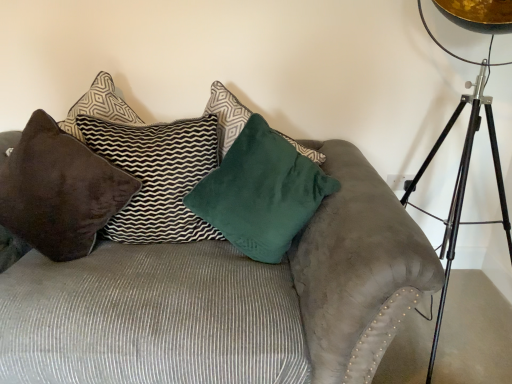
Question: Is velvet brown pillow at upper left, the second pillow when ordered from right to left, further to the viewer compared to suede couch at center?

Choices:
 (A) yes
 (B) no

Answer: (A)

Question: Is velvet brown pillow at upper left, which ranks as the 2th pillow in left-to-right order, taller than suede couch at center?

Choices:
 (A) yes
 (B) no

Answer: (B)

Question: Is suede couch at center inside velvet brown pillow at upper left, the second pillow when ordered from right to left?

Choices:
 (A) yes
 (B) no

Answer: (B)

Question: Could you tell me if velvet brown pillow at upper left, which ranks as the 2th pillow in left-to-right order, is turned towards suede couch at center?

Choices:
 (A) yes
 (B) no

Answer: (A)

Question: From a real-world perspective, is suede couch at center physically located above or below velvet brown pillow at upper left, which ranks as the 2th pillow in left-to-right order?

Choices:
 (A) below
 (B) above

Answer: (A)

Question: Is suede couch at center situated inside velvet brown pillow at upper left, the second pillow when ordered from right to left, or outside?

Choices:
 (A) outside
 (B) inside

Answer: (A)

Question: In the image, is suede couch at center positioned in front of or behind velvet brown pillow at upper left, which ranks as the 2th pillow in left-to-right order?

Choices:
 (A) front
 (B) behind

Answer: (A)

Question: Visually, is suede couch at center positioned to the left or to the right of velvet brown pillow at upper left, the second pillow when ordered from right to left?

Choices:
 (A) right
 (B) left

Answer: (A)

Question: Is suede couch at center wider or thinner than velvet green pillow at center, the 3th pillow positioned from the left?

Choices:
 (A) wide
 (B) thin

Answer: (A)

Question: From the image's perspective, is suede couch at center positioned above or below velvet green pillow at center, the 3th pillow positioned from the left?

Choices:
 (A) below
 (B) above

Answer: (A)

Question: Based on their sizes in the image, would you say suede couch at center is bigger or smaller than velvet green pillow at center, the 3th pillow positioned from the left?

Choices:
 (A) big
 (B) small

Answer: (A)

Question: Considering their positions, is suede couch at center located in front of or behind velvet green pillow at center, the 3th pillow positioned from the left?

Choices:
 (A) behind
 (B) front

Answer: (B)

Question: Considering the positions of velvet green pillow at center, which is counted as the 1th pillow, starting from the right, and velvet brown pillow at upper left, the second pillow when ordered from right to left, in the image, is velvet green pillow at center, which is counted as the 1th pillow, starting from the right, taller or shorter than velvet brown pillow at upper left, the second pillow when ordered from right to left,?

Choices:
 (A) short
 (B) tall

Answer: (A)

Question: From a real-world perspective, is velvet green pillow at center, the 3th pillow positioned from the left, above or below velvet brown pillow at upper left, which ranks as the 2th pillow in left-to-right order?

Choices:
 (A) below
 (B) above

Answer: (B)